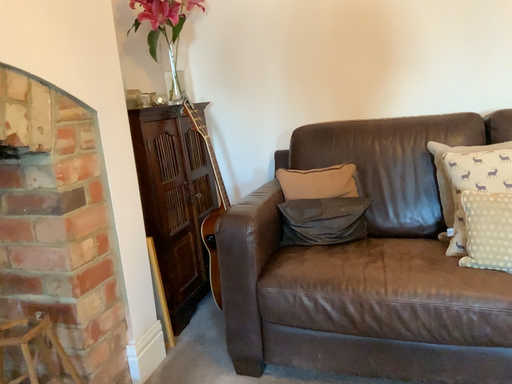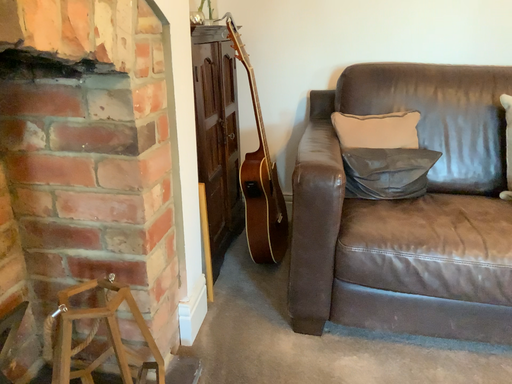
Question: How did the camera likely rotate when shooting the video?

Choices:
 (A) rotated left
 (B) rotated right

Answer: (B)